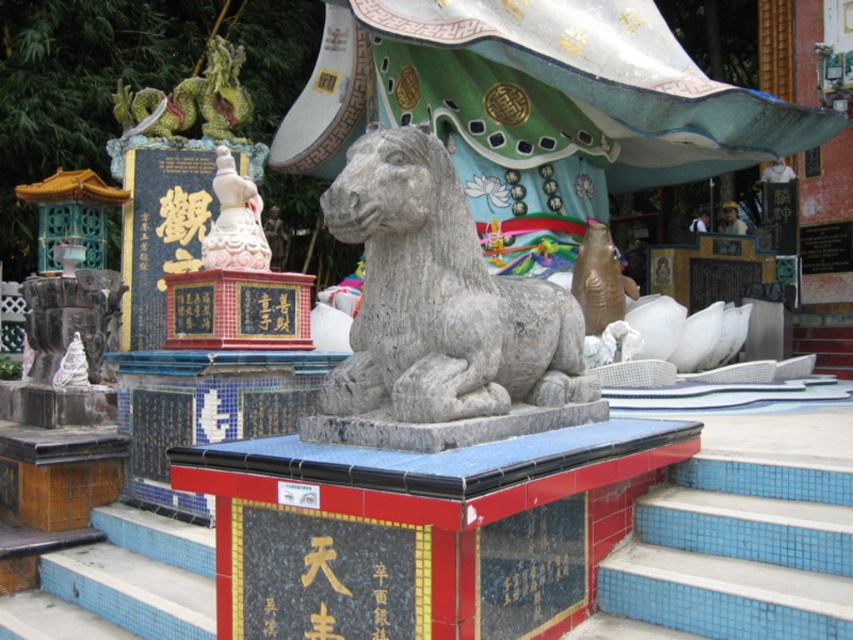
You are standing in front of the temple scene and need to locate the gray stone horse at center. According to the coordinates provided, where exactly is it positioned?

The gray stone horse at center is located at point (440, 316), which places it nearly at the center of the scene.

Consider the image. You are a visitor at the temple and want to take a photo of the gray stone horse at center without any obstructions. Since you are standing at the bottom of the blue tile stairs at lower left, can you move forward to get a clear shot?

The gray stone horse at center is positioned over the blue tile stairs at lower left, so moving forward along the blue tile stairs at lower left would place you directly underneath it. This position should allow you to take a clear photo without obstructions as there is no object blocking the view between you and the gray stone horse at center.

You are a visitor standing in front of the temple and want to take a photo of both the gray stone horse at center and the white marble statue at left. Which one of them should you focus on first to ensure both are in frame?

Since the gray stone horse at center is shorter than the white marble statue at left, you should focus on the white marble statue at left first to ensure both are in frame.